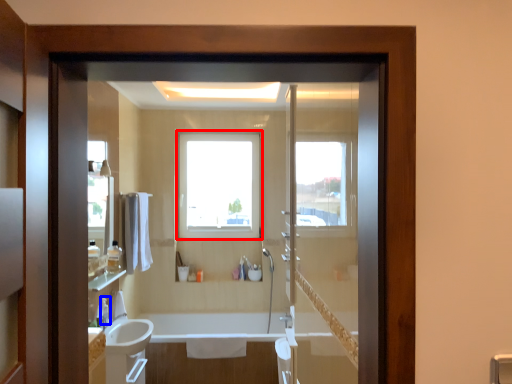
Question: Which object appears farthest to the camera in this image, window (highlighted by a red box) or toiletry (highlighted by a blue box)?

Choices:
 (A) window
 (B) toiletry

Answer: (A)